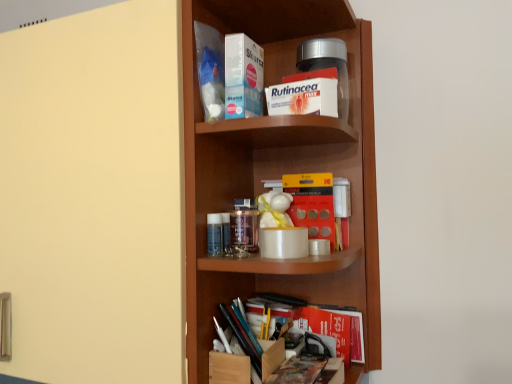
Question: Is transparent glass jar at center at the back of wooden shelf at center?

Choices:
 (A) no
 (B) yes

Answer: (B)

Question: From a real-world perspective, is wooden shelf at center over transparent glass jar at center?

Choices:
 (A) yes
 (B) no

Answer: (A)

Question: From the image's perspective, is wooden shelf at center below transparent glass jar at center?

Choices:
 (A) yes
 (B) no

Answer: (B)

Question: Is wooden shelf at center to the left of transparent glass jar at center from the viewer's perspective?

Choices:
 (A) yes
 (B) no

Answer: (B)

Question: From the image's perspective, is wooden shelf at center on top of transparent glass jar at center?

Choices:
 (A) no
 (B) yes

Answer: (B)

Question: Does wooden shelf at center have a larger size compared to transparent glass jar at center?

Choices:
 (A) yes
 (B) no

Answer: (A)

Question: From the image's perspective, is white cardboard box at upper center, arranged as the third book when ordered from the bottom, above blue plastic bag at upper center, which is counted as the fifth book, starting from the bottom?

Choices:
 (A) yes
 (B) no

Answer: (B)

Question: Are white cardboard box at upper center, arranged as the third book when ordered from the bottom, and blue plastic bag at upper center, which appears as the first book when viewed from the top, located far from each other?

Choices:
 (A) no
 (B) yes

Answer: (A)

Question: Could blue plastic bag at upper center, which appears as the first book when viewed from the top, be considered to be inside white cardboard box at upper center, arranged as the third book when ordered from the bottom?

Choices:
 (A) no
 (B) yes

Answer: (A)

Question: Can you confirm if white cardboard box at upper center, arranged as the third book when ordered from the bottom, is taller than blue plastic bag at upper center, which is counted as the fifth book, starting from the bottom?

Choices:
 (A) yes
 (B) no

Answer: (B)

Question: Is the surface of white cardboard box at upper center, which ranks as the third book in top-to-bottom order, in direct contact with blue plastic bag at upper center, which appears as the first book when viewed from the top?

Choices:
 (A) no
 (B) yes

Answer: (A)

Question: From the image's perspective, is white cardboard box at upper center, which ranks as the third book in top-to-bottom order, below blue plastic bag at upper center, which appears as the first book when viewed from the top?

Choices:
 (A) yes
 (B) no

Answer: (A)

Question: Is red paper book at lower center, positioned as the 1th book in bottom-to-top order, bigger than matte yellow door at left?

Choices:
 (A) no
 (B) yes

Answer: (A)